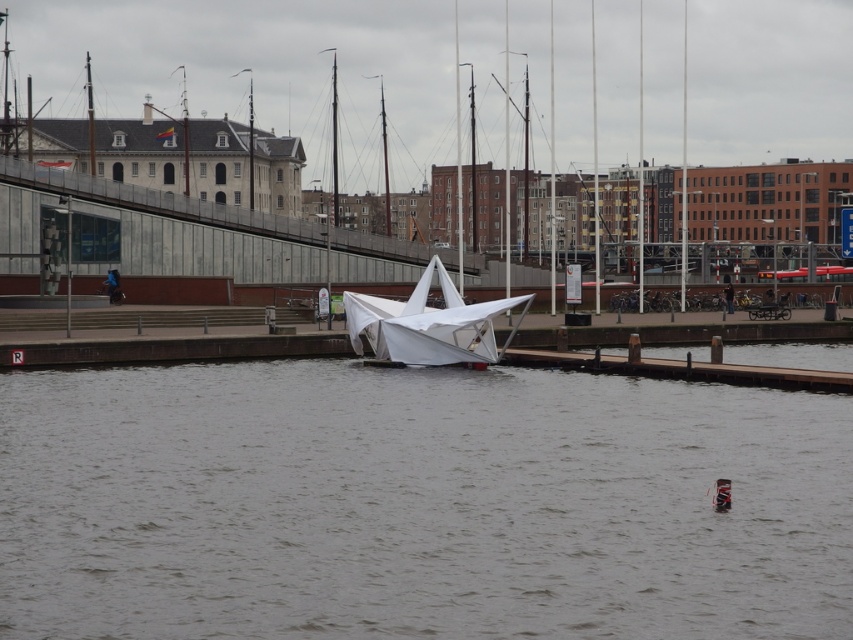
Question: Does gray matte water at center have a lesser width compared to white matte sailboat at center?

Choices:
 (A) no
 (B) yes

Answer: (A)

Question: Which object appears farthest from the camera in this image?

Choices:
 (A) gray matte water at center
 (B) white matte sailboat at center

Answer: (B)

Question: Is gray matte water at center wider than white matte sailboat at center?

Choices:
 (A) no
 (B) yes

Answer: (B)

Question: Does gray matte water at center lie in front of white matte sailboat at center?

Choices:
 (A) yes
 (B) no

Answer: (A)